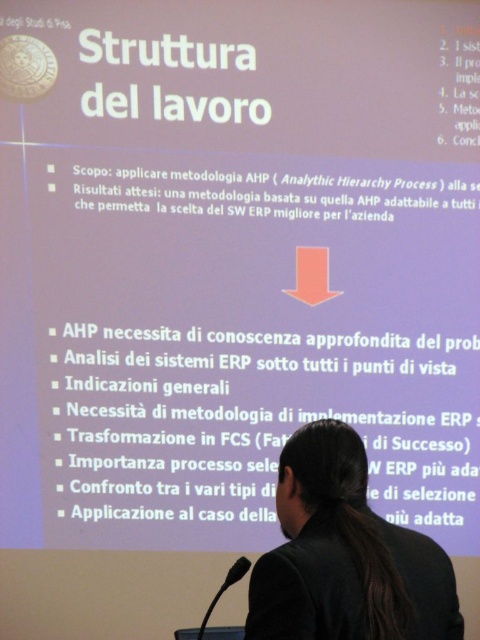
In the scene shown: You are an event organizer and need to ensure that the black plastic microphone at lower center is visible to the audience. Considering the black hair at center, which object is wider and might block the microphone? Please suggest a way to adjust their positions for better visibility.

The black hair at center is wider than the black plastic microphone at lower center. To ensure visibility, move the black hair at center to the side so it doesn not cover the microphone.

You are a photographer adjusting the focus on your camera to capture the presentation slide. You need to ensure that both the point at coordinates point (381, 524) and the point at coordinates point (238, 577) are in focus. Since the camera can only focus on one plane at a time, which point should you focus on to maximize the likelihood that both points are sharp?

You should focus on the point closer to the camera, which is point (381, 524). This is because focusing on the closer point will allow the farther point to still be within the depth of field, maximizing sharpness for both.

What is the exact coordinate of the black hair at center?

The black hair at center is located at point (345, 556).